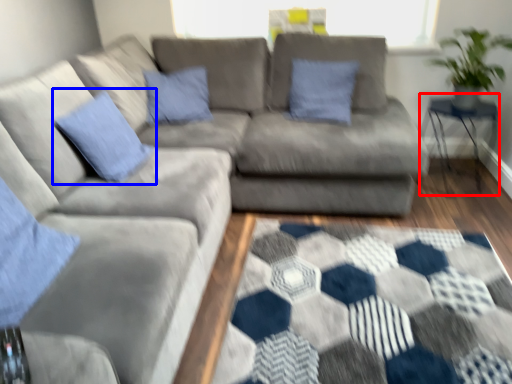
Question: Which point is further to the camera, table (highlighted by a red box) or pillow (highlighted by a blue box)?

Choices:
 (A) table
 (B) pillow

Answer: (A)